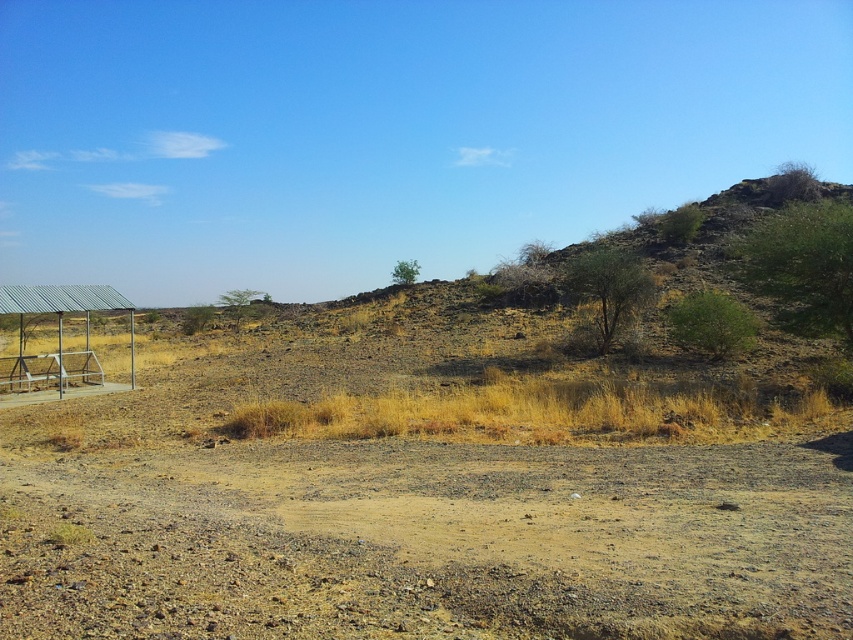
You are a hiker planning to walk along the brown gravel dirt track at center and pass by the metallic roof at left. Which of these two objects is lower in height?

The brown gravel dirt track at center is not as tall as the metallic roof at left, so the dirt track is lower in height.

You are standing at the base of the elevation in the midground and want to reach the metallic roof at left. Which direction should you go to avoid the brown gravel dirt track at center?

To avoid the brown gravel dirt track at center, you should move towards the midground elevation since the brown gravel dirt track at center is below the metallic roof at left, indicating it is located lower in elevation.

You are standing at the point marked by the coordinates point (430, 541) in the image. Looking around, you see the dry, arid landscape with sparse vegetation and scattered rocks. What direction should you face to see the metal roofed structure on the left side of the image?

The metal roofed structure is on the left side of the image, so facing left from the point (430, 541) would allow you to see it.